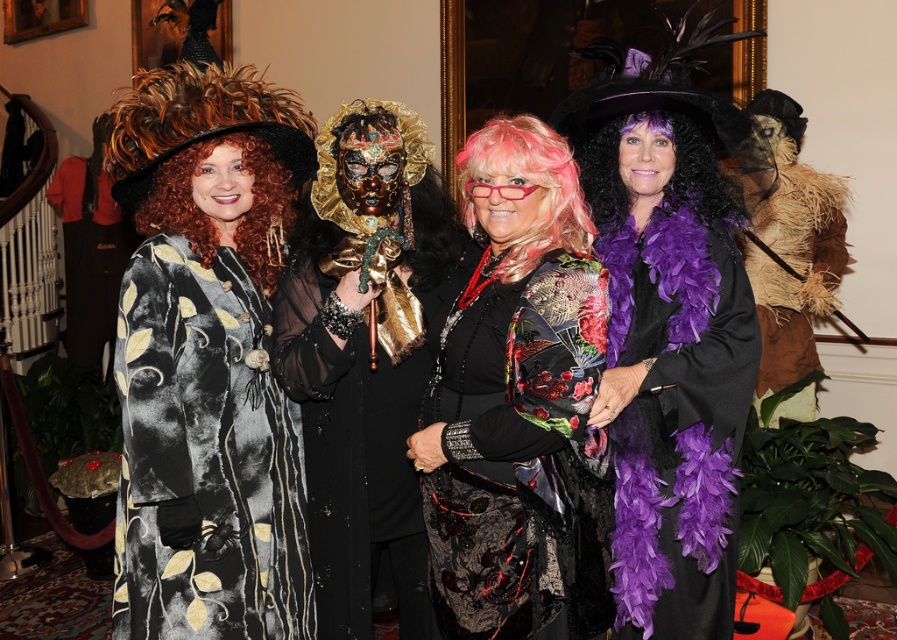
Question: Does purple feather boa at right appear under gold metallic mask at center?

Choices:
 (A) yes
 (B) no

Answer: (B)

Question: Can you confirm if shiny black dress at center is positioned above purple feather boa at center?

Choices:
 (A) yes
 (B) no

Answer: (B)

Question: From the image, what is the correct spatial relationship of shiny black dress at center in relation to pink feathered wig at center?

Choices:
 (A) left
 (B) right

Answer: (A)

Question: Which point appears closest to the camera in this image?

Choices:
 (A) (624, 204)
 (B) (562, 236)

Answer: (B)

Question: Which point appears farthest from the camera in this image?

Choices:
 (A) (253, 244)
 (B) (599, 480)
 (C) (606, 230)
 (D) (636, 124)

Answer: (C)

Question: Which point appears farthest from the camera in this image?

Choices:
 (A) (547, 220)
 (B) (208, 221)

Answer: (B)